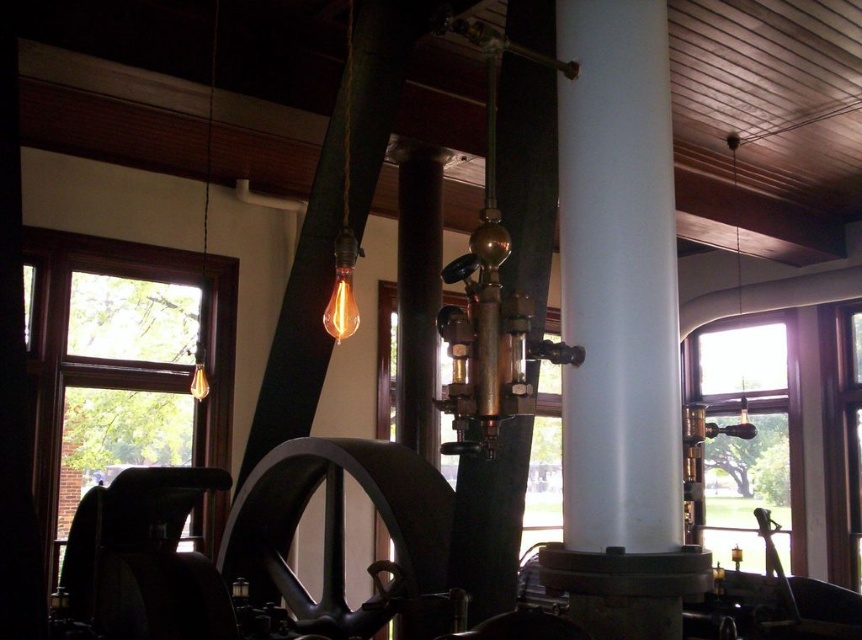
You are a maintenance worker in a historic building. You need to move a tool box that is 2 meters wide from the white glossy pillar at center to the clear glass window at left. Is there enough space between them to move the tool box without tilting it sideways?

The white glossy pillar at center and clear glass window at left are 3.66 meters apart, so yes, the tool box that is 2 meters wide can be moved between them without tilting sideways since the distance is sufficient.

You are a maintenance worker in this historic building. You need to access both the white glossy pillar at center and the clear glass window at right. Which object should you approach first if you are standing at the entrance facing the room?

You should approach the white glossy pillar at center first because it is closer to you than the clear glass window at right.